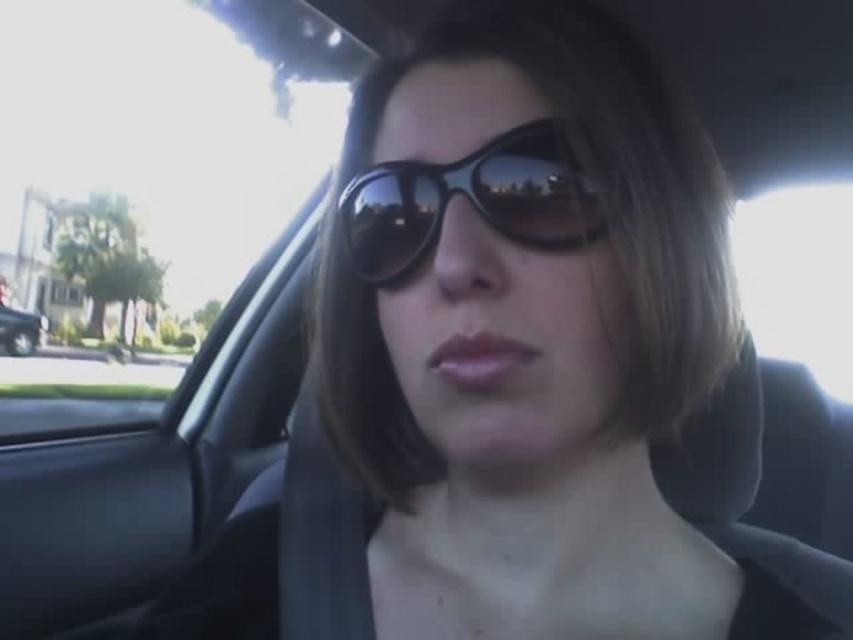
You are a delivery person needing to hand over a package to the person in the car. The transparent glass car window at upper left and metallic silver car at left are in your line of sight. Which object is wider from your perspective?

The transparent glass car window at upper left is wider than the metallic silver car at left.

You are a photographer trying to capture a portrait of the person wearing the black reflective sunglasses at center and the metallic silver car at left. Since the sunglasses are reflective, you want to ensure they don not reflect the car. Based on their sizes, can you position the camera so that the sunglasses do not reflect the car?

The black reflective sunglasses at center is thinner than the metallic silver car at left. Since the sunglasses are smaller in width, positioning the camera at an angle where the car is outside the reflective surface of the sunglasses would prevent the car from being reflected in them.

You are a photographer trying to capture a clear shot of the black reflective sunglasses at center and the metallic silver car at left. Since the sunglasses are smaller, would you need to adjust your camera focus to ensure both are in focus?

The black reflective sunglasses at center is shorter than the metallic silver car at left, so adjusting the focus to accommodate the smaller size of the sunglasses might help ensure both are in focus.